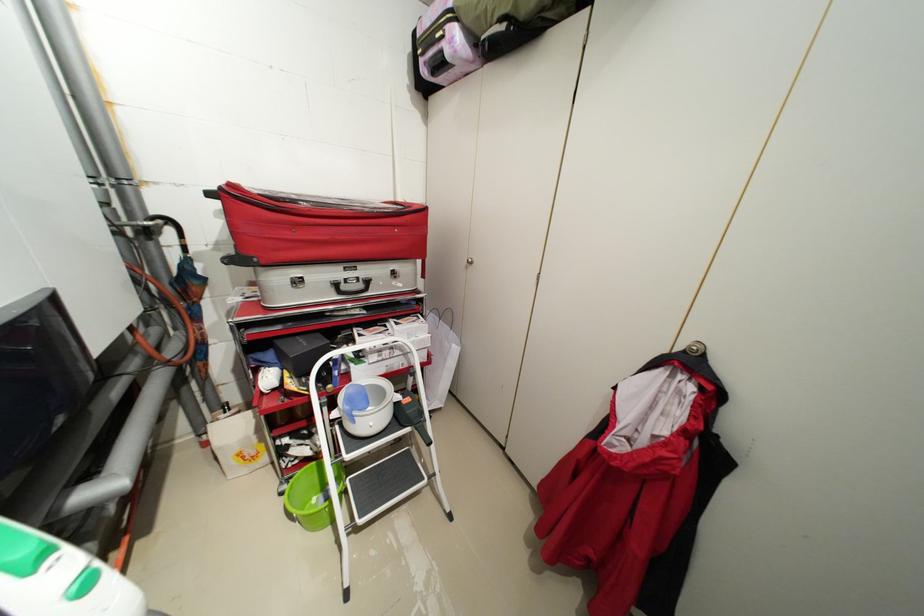
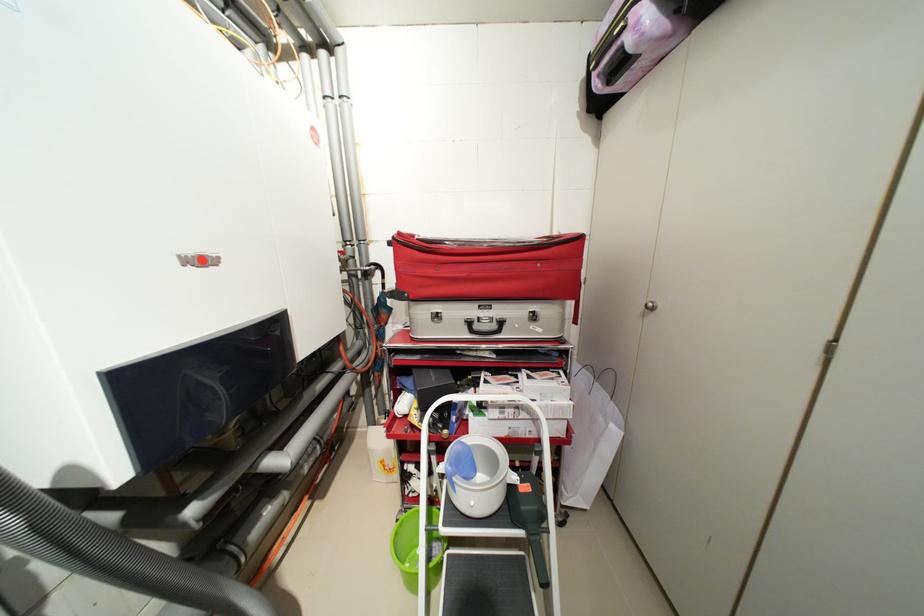
In the second image, find the point that corresponds to point (359, 419) in the first image.

(459, 485)